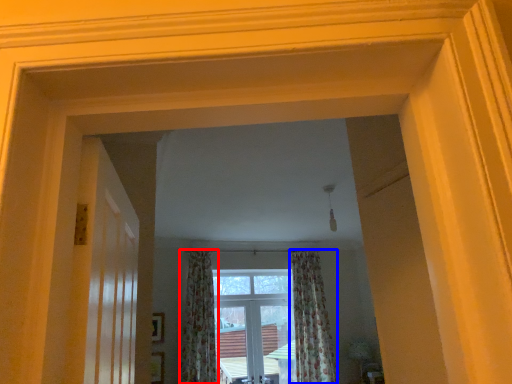
Question: Which of the following is the farthest to the observer, curtain (highlighted by a red box) or curtain (highlighted by a blue box)?

Choices:
 (A) curtain
 (B) curtain

Answer: (B)